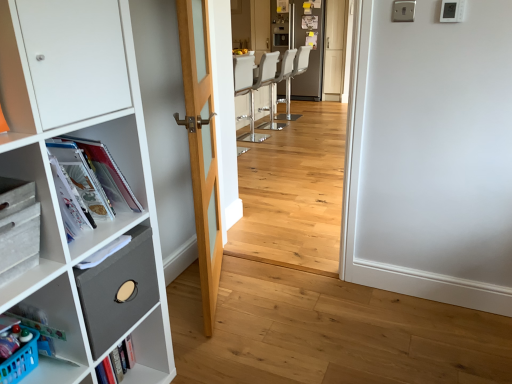
Question: Is matte gray drawer at left to the left of matte plastic magazines at left from the viewer's perspective?

Choices:
 (A) no
 (B) yes

Answer: (B)

Question: Can you see matte gray drawer at left touching matte plastic magazines at left?

Choices:
 (A) yes
 (B) no

Answer: (B)

Question: Is matte gray drawer at left far away from matte plastic magazines at left?

Choices:
 (A) no
 (B) yes

Answer: (A)

Question: Can you confirm if matte gray drawer at left is bigger than matte plastic magazines at left?

Choices:
 (A) no
 (B) yes

Answer: (A)

Question: Can you confirm if matte gray drawer at left is positioned to the right of matte plastic magazines at left?

Choices:
 (A) no
 (B) yes

Answer: (A)

Question: Is matte gray drawer at left facing towards matte plastic magazines at left?

Choices:
 (A) no
 (B) yes

Answer: (A)

Question: Is white leather bar stool at center shorter than natural wood door at center?

Choices:
 (A) no
 (B) yes

Answer: (B)

Question: Is white leather bar stool at center turned away from natural wood door at center?

Choices:
 (A) no
 (B) yes

Answer: (A)

Question: Is white leather bar stool at center surrounding natural wood door at center?

Choices:
 (A) yes
 (B) no

Answer: (B)

Question: Does white leather bar stool at center have a greater width compared to natural wood door at center?

Choices:
 (A) no
 (B) yes

Answer: (B)

Question: Is white leather bar stool at center taller than natural wood door at center?

Choices:
 (A) yes
 (B) no

Answer: (B)

Question: Considering the relative positions of white leather bar stool at center and natural wood door at center in the image provided, is white leather bar stool at center to the right of natural wood door at center from the viewer's perspective?

Choices:
 (A) yes
 (B) no

Answer: (A)

Question: Does white leather bar stool at center, which appears as the 1th armchair when viewed from the back, contain light wood floor at center?

Choices:
 (A) no
 (B) yes

Answer: (A)